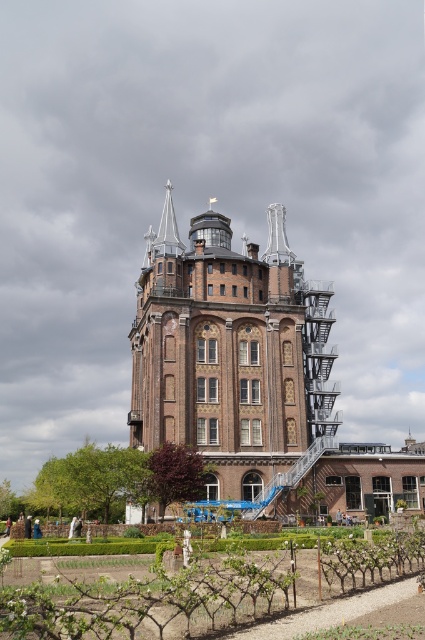
You are standing in front of the historic brick building and want to determine the relative positions of two points marked on the structure. The first point is located at coordinates point (x=325, y=390) and the second at point (x=53, y=628). Which point is closer to you?

Point (x=325, y=390) is further to the viewer than point (x=53, y=628), so the point closer to you is point (x=53, y=628).

You are standing at point [232,356] in the image. What is the object located at this point?

The brown brick tower at center is located at point [232,356].